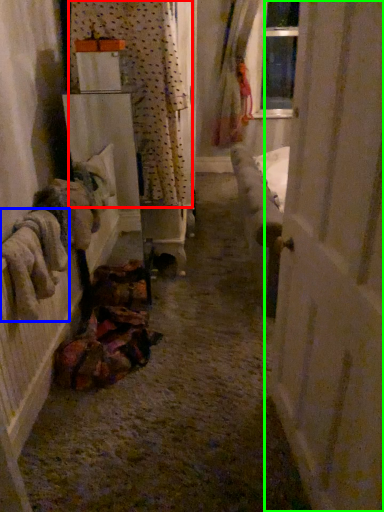
Question: Considering the real-world distances, which object is closest to curtain (highlighted by a red box)? clothing (highlighted by a blue box) or door (highlighted by a green box).

Choices:
 (A) clothing
 (B) door

Answer: (A)